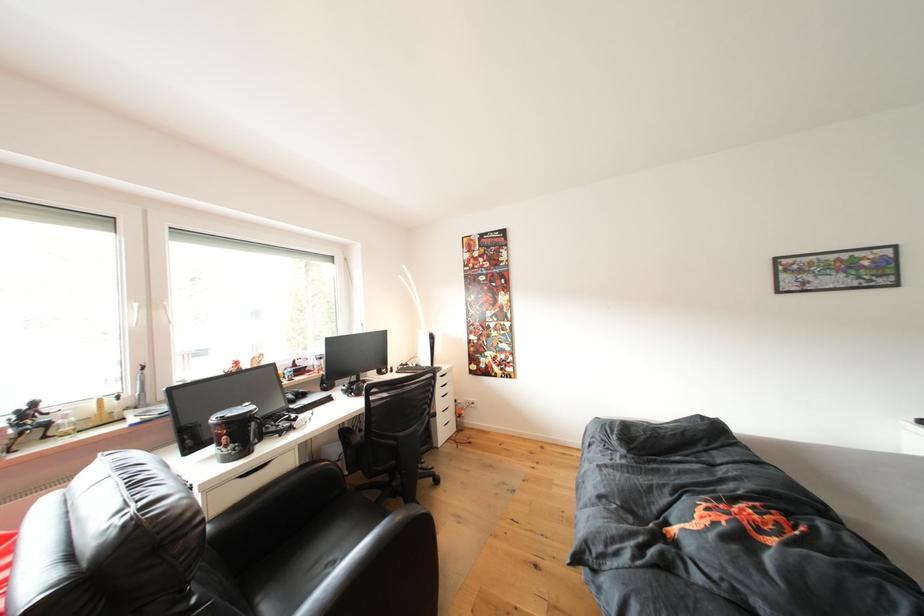
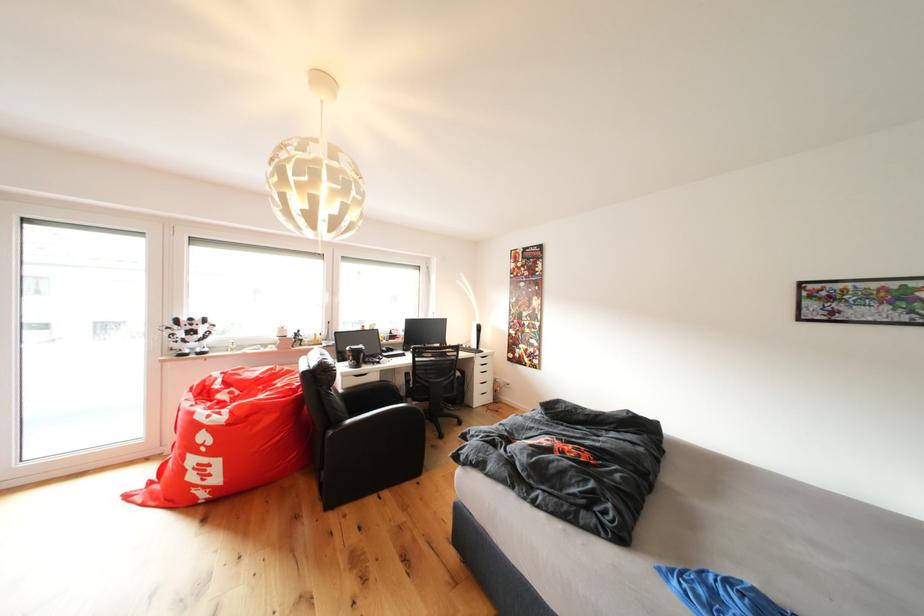
In the second image, find the point that corresponds to [237,427] in the first image.

(361, 355)